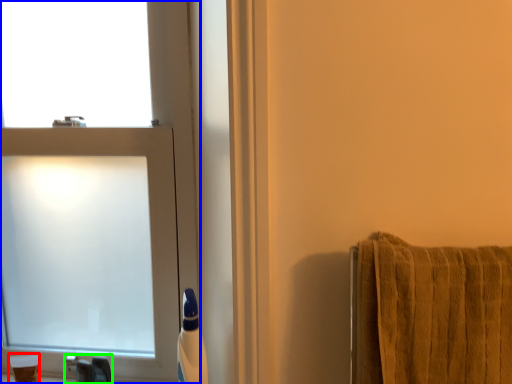
Question: Estimate the real-world distances between objects in this image. Which object is farther from toiletry (highlighted by a red box), window (highlighted by a blue box) or faucet (highlighted by a green box)?

Choices:
 (A) window
 (B) faucet

Answer: (A)